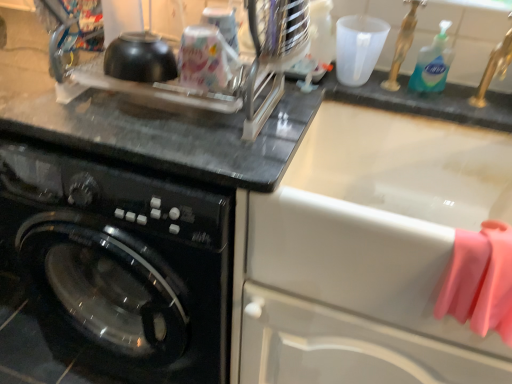
Question: Can you see pink rubber gloves at right touching black glossy washing machine at left?

Choices:
 (A) no
 (B) yes

Answer: (A)

Question: From a real-world perspective, is pink rubber gloves at right on top of black glossy washing machine at left?

Choices:
 (A) yes
 (B) no

Answer: (A)

Question: Does pink rubber gloves at right have a lesser width compared to black glossy washing machine at left?

Choices:
 (A) yes
 (B) no

Answer: (A)

Question: Would you say pink rubber gloves at right is a long distance from black glossy washing machine at left?

Choices:
 (A) no
 (B) yes

Answer: (A)

Question: Does pink rubber gloves at right lie in front of black glossy washing machine at left?

Choices:
 (A) yes
 (B) no

Answer: (A)

Question: From the image's perspective, does pink rubber gloves at right appear lower than black glossy washing machine at left?

Choices:
 (A) yes
 (B) no

Answer: (A)

Question: From the image's perspective, is blue liquid soap at upper right under pink rubber gloves at right?

Choices:
 (A) no
 (B) yes

Answer: (A)

Question: Is pink rubber gloves at right surrounded by blue liquid soap at upper right?

Choices:
 (A) yes
 (B) no

Answer: (B)

Question: Does blue liquid soap at upper right have a lesser height compared to pink rubber gloves at right?

Choices:
 (A) no
 (B) yes

Answer: (B)

Question: Can you confirm if blue liquid soap at upper right is thinner than pink rubber gloves at right?

Choices:
 (A) no
 (B) yes

Answer: (B)

Question: Does blue liquid soap at upper right have a smaller size compared to pink rubber gloves at right?

Choices:
 (A) yes
 (B) no

Answer: (A)

Question: Is blue liquid soap at upper right facing away from pink rubber gloves at right?

Choices:
 (A) yes
 (B) no

Answer: (B)

Question: Is blue liquid soap at upper right at the back of black glossy washing machine at left?

Choices:
 (A) no
 (B) yes

Answer: (A)